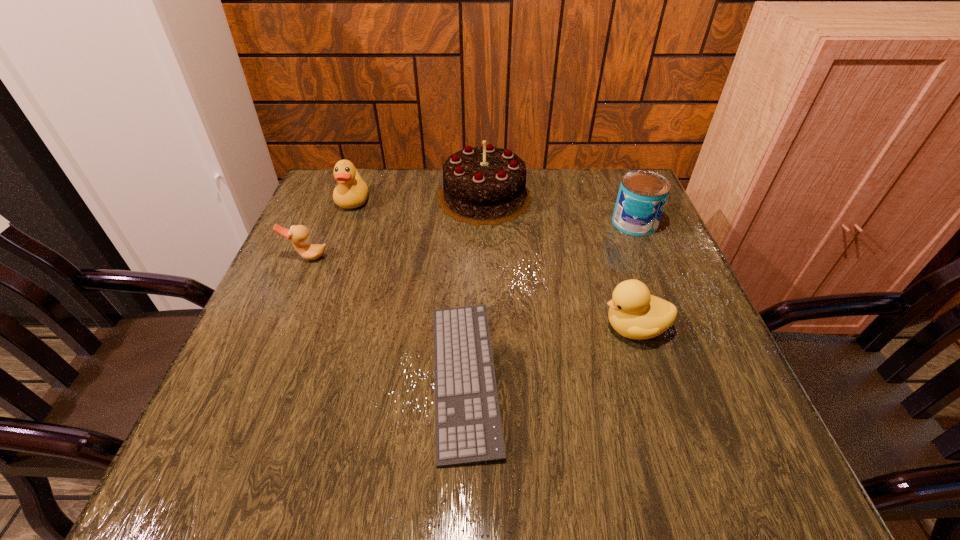
Identify the location of duck that is at the right edge. This screenshot has height=540, width=960. (634, 313).

Locate an element on the screen. The image size is (960, 540). object that is at the far left corner is located at coordinates (352, 191).

Where is `object that is positioned at the far right corner`? Image resolution: width=960 pixels, height=540 pixels. object that is positioned at the far right corner is located at coordinates (642, 196).

What are the coordinates of `vacant space at the far edge of the desktop` in the screenshot? It's located at pyautogui.click(x=560, y=208).

What are the coordinates of `vacant area at the near edge` in the screenshot? It's located at (559, 467).

Where is `vacant space at the left edge of the desktop`? vacant space at the left edge of the desktop is located at coordinates (300, 221).

This screenshot has width=960, height=540. I want to click on vacant space at the right edge of the desktop, so point(678,355).

Where is `free space at the far right corner of the desktop`? The height and width of the screenshot is (540, 960). free space at the far right corner of the desktop is located at coordinates (620, 173).

Image resolution: width=960 pixels, height=540 pixels. Identify the location of free space between the nearest duck and the birthday cake. (560, 262).

Identify the location of vacant point located between the tallest object and the farthest duck. The image size is (960, 540). (419, 199).